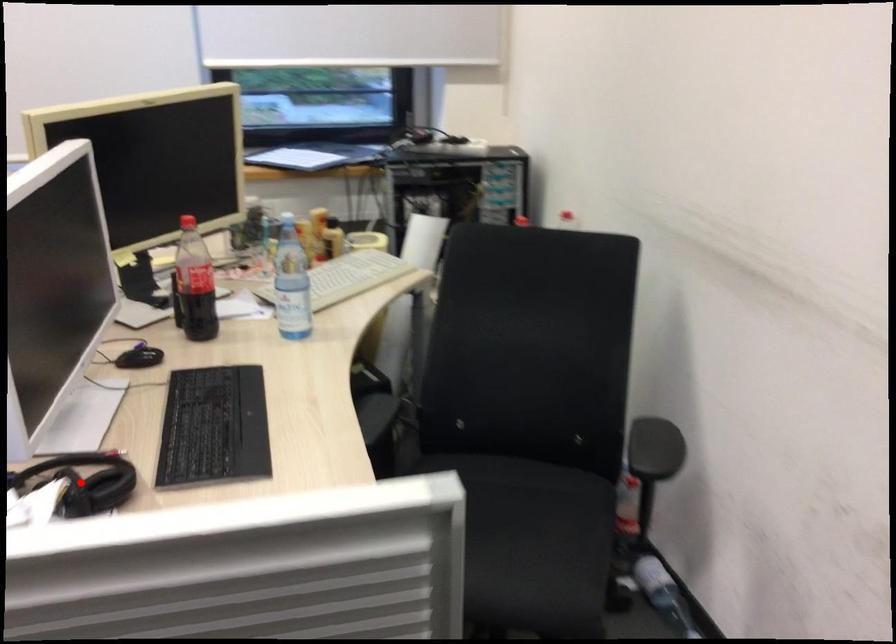
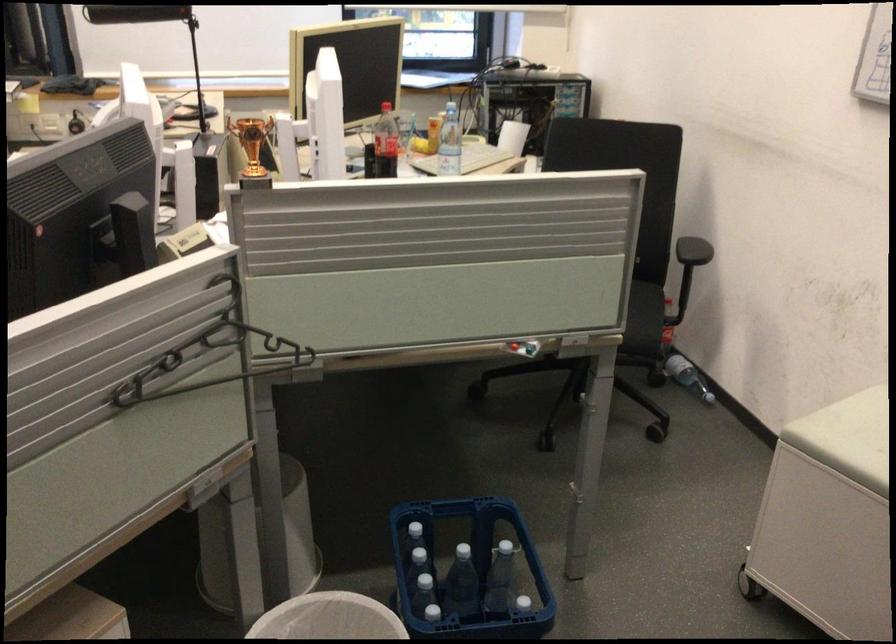
Question: I am providing you with two images of the same scene from different viewpoints. A red point is marked on the first image. Can you still see the location of the red point in image 2?

Choices:
 (A) Yes
 (B) No

Answer: (B)